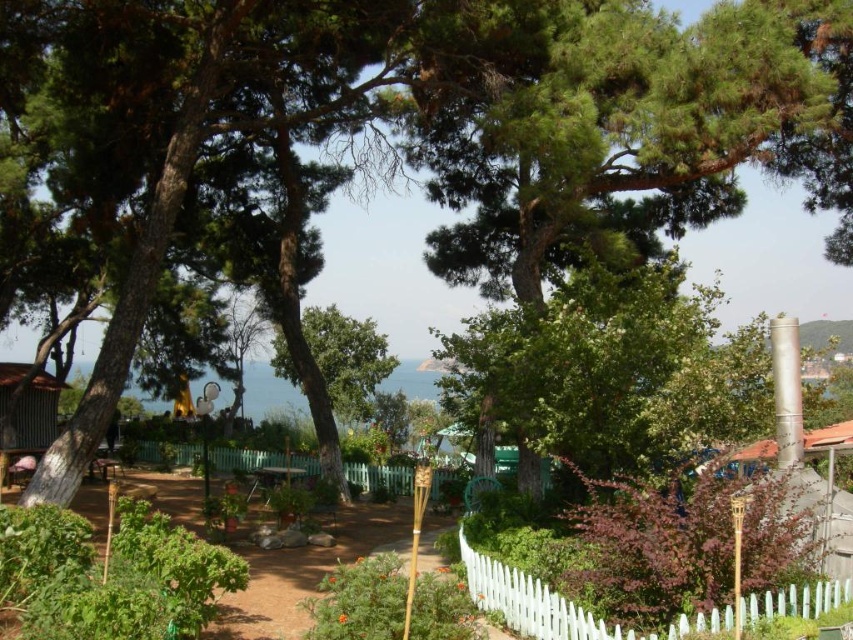
You are planning to set up a tent for a small gathering. The green leafy tree at center and the wooden hut at right are in the way. Which one should you move to have more space?

You should move the wooden hut at right because the green leafy tree at center is taller and harder to move compared to the wooden hut at right.

You are planning to take a photo of the white picket fence at center and the wooden hut at right from a position where both are visible. Which object will appear larger in the photo?

The white picket fence at center will appear larger in the photo because it is closer to the viewer than the wooden hut at right.